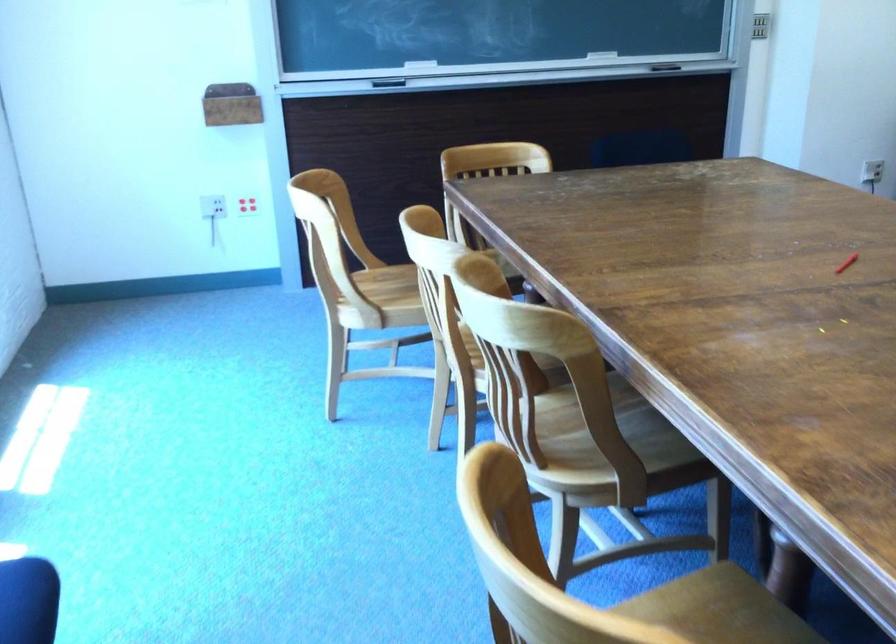
The height and width of the screenshot is (644, 896). Describe the element at coordinates (393, 286) in the screenshot. I see `the light wood chair sitting surface` at that location.